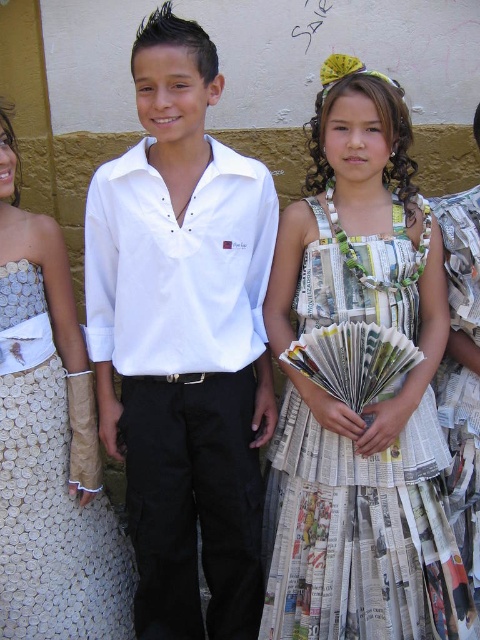
Question: Estimate the real-world distances between objects in this image. Which object is closer to the white cotton shirt at center?

Choices:
 (A) recycled paper dress at center
 (B) white textured fabric dress at center

Answer: (A)

Question: Which object appears farthest from the camera in this image?

Choices:
 (A) recycled paper dress at center
 (B) white cotton shirt at center

Answer: (A)

Question: Can you confirm if recycled paper dress at center is bigger than white textured fabric dress at center?

Choices:
 (A) yes
 (B) no

Answer: (A)

Question: Does white cotton shirt at center have a smaller size compared to white textured fabric dress at center?

Choices:
 (A) yes
 (B) no

Answer: (B)

Question: Which point is closer to the camera?

Choices:
 (A) (265, 346)
 (B) (432, 438)

Answer: (B)

Question: Can you confirm if recycled paper dress at center is bigger than white textured fabric dress at center?

Choices:
 (A) no
 (B) yes

Answer: (B)